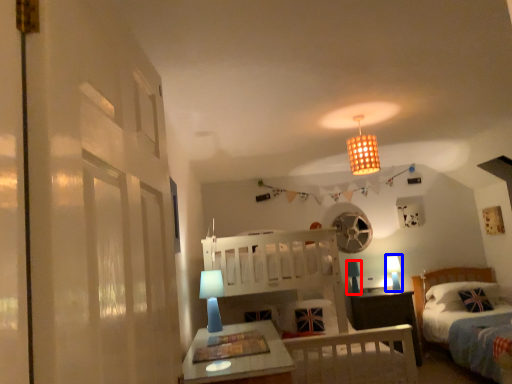
Question: Which object is further to the camera taking this photo, table lamp (highlighted by a red box) or table lamp (highlighted by a blue box)?

Choices:
 (A) table lamp
 (B) table lamp

Answer: (B)